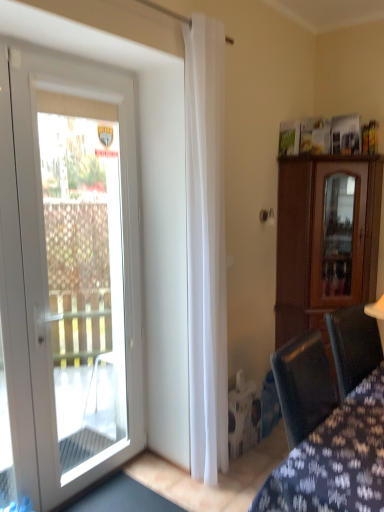
Question: Is velvet dark blue chair at lower right closer to camera compared to white glass door at left?

Choices:
 (A) yes
 (B) no

Answer: (A)

Question: Considering the relative sizes of velvet dark blue chair at lower right and white glass door at left in the image provided, is velvet dark blue chair at lower right bigger than white glass door at left?

Choices:
 (A) no
 (B) yes

Answer: (B)

Question: Is velvet dark blue chair at lower right at the right side of white glass door at left?

Choices:
 (A) no
 (B) yes

Answer: (B)

Question: From the image's perspective, would you say velvet dark blue chair at lower right is shown under white glass door at left?

Choices:
 (A) yes
 (B) no

Answer: (A)

Question: Does velvet dark blue chair at lower right have a greater width compared to white glass door at left?

Choices:
 (A) no
 (B) yes

Answer: (A)

Question: Is velvet dark blue chair at lower right facing towards white glass door at left?

Choices:
 (A) yes
 (B) no

Answer: (B)

Question: Is white sheer curtain at center closer to the viewer compared to brown wooden cabinet at right?

Choices:
 (A) yes
 (B) no

Answer: (A)

Question: Considering the relative sizes of white sheer curtain at center and brown wooden cabinet at right in the image provided, is white sheer curtain at center wider than brown wooden cabinet at right?

Choices:
 (A) no
 (B) yes

Answer: (A)

Question: Can you confirm if white sheer curtain at center is shorter than brown wooden cabinet at right?

Choices:
 (A) no
 (B) yes

Answer: (A)

Question: Considering the relative sizes of white sheer curtain at center and brown wooden cabinet at right in the image provided, is white sheer curtain at center bigger than brown wooden cabinet at right?

Choices:
 (A) yes
 (B) no

Answer: (B)

Question: From the image's perspective, is white sheer curtain at center above brown wooden cabinet at right?

Choices:
 (A) yes
 (B) no

Answer: (A)

Question: Is white sheer curtain at center oriented away from brown wooden cabinet at right?

Choices:
 (A) no
 (B) yes

Answer: (A)

Question: Is white sheer curtain at center positioned far away from white glass door at left?

Choices:
 (A) yes
 (B) no

Answer: (B)